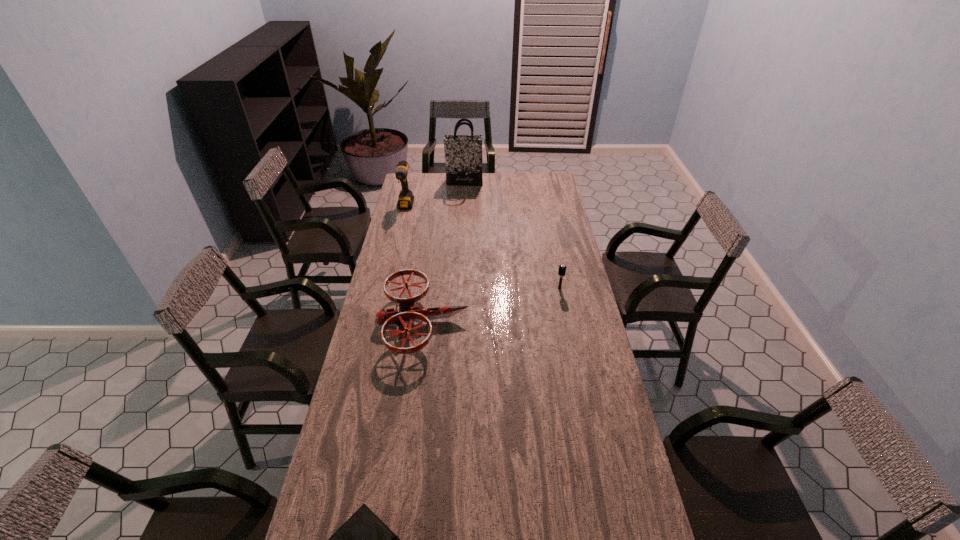
The width and height of the screenshot is (960, 540). In order to click on free space that satisfies the following two spatial constraints: 1. on the back side of the drone; 2. on the right side of the rightmost object in this screenshot , I will do `click(428, 288)`.